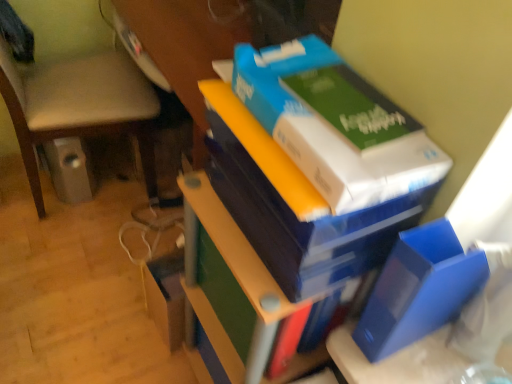
Locate an element on the screen. The width and height of the screenshot is (512, 384). vacant region below beige fabric chair at lower left (from a real-world perspective) is located at coordinates (108, 183).